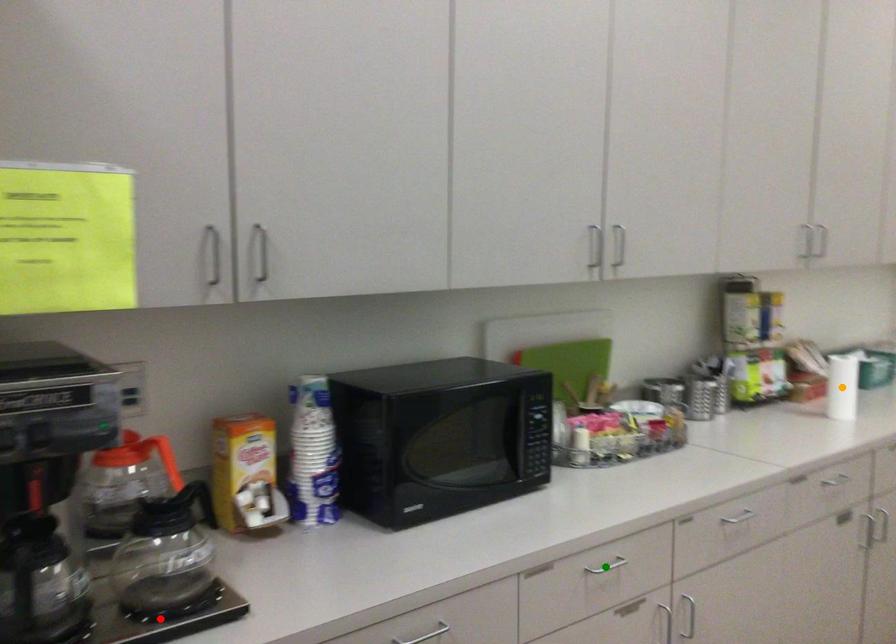
Order these from nearest to farthest:
- red point
- orange point
- green point

red point, green point, orange point